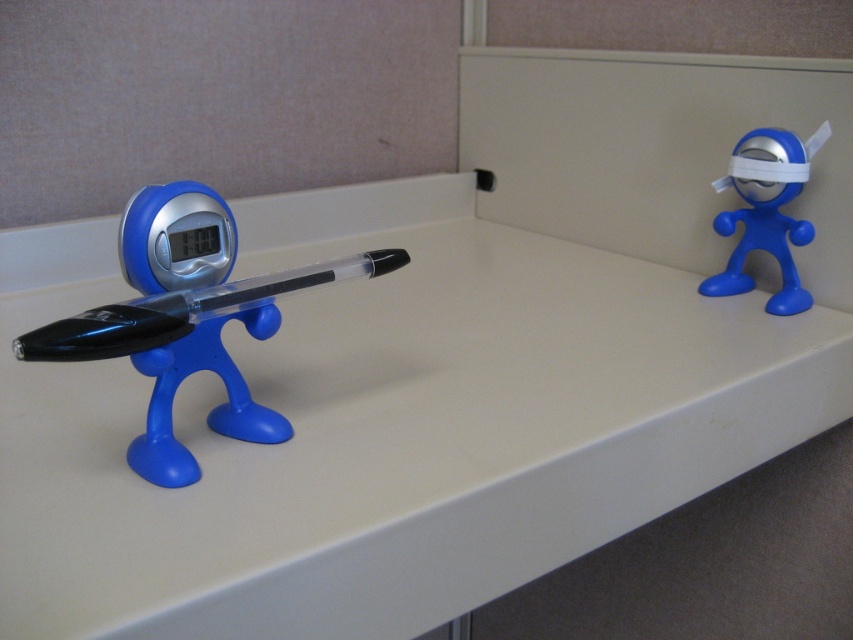
Question: Estimate the real-world distances between objects in this image. Which object is closer to the matte plastic pen holder at left?

Choices:
 (A) blue matte toy at right
 (B) transparent plastic pen at left
 (C) white matte counter top at center

Answer: (B)

Question: Observing the image, what is the correct spatial positioning of matte plastic pen holder at left in reference to blue matte toy at right?

Choices:
 (A) left
 (B) right

Answer: (A)

Question: Among these objects, which one is nearest to the camera?

Choices:
 (A) matte plastic pen holder at left
 (B) transparent plastic pen at left

Answer: (A)

Question: Does matte plastic pen holder at left appear under blue matte toy at right?

Choices:
 (A) yes
 (B) no

Answer: (A)

Question: Can you confirm if white matte counter top at center is positioned below blue matte toy at right?

Choices:
 (A) no
 (B) yes

Answer: (B)

Question: Which point is closer to the camera?

Choices:
 (A) (148, 518)
 (B) (224, 288)

Answer: (A)